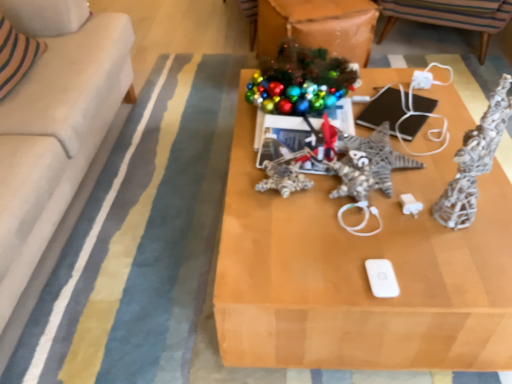
Identify the location of vacant position to the left of white matte ipod at center. This screenshot has width=512, height=384. (310, 269).